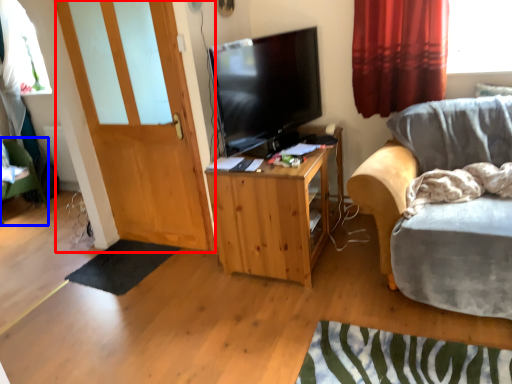
Question: Among these objects, which one is nearest to the camera, door (highlighted by a red box) or desk (highlighted by a blue box)?

Choices:
 (A) door
 (B) desk

Answer: (A)